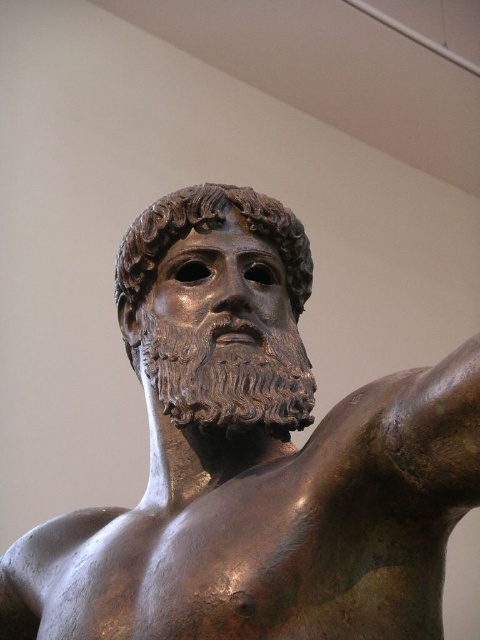
Question: Can you confirm if bronze statue at center is positioned to the right of bronze mask at center?

Choices:
 (A) yes
 (B) no

Answer: (A)

Question: Which object appears closest to the camera in this image?

Choices:
 (A) bronze statue at center
 (B) bronze mask at center

Answer: (B)

Question: Which point is farther to the camera?

Choices:
 (A) (193, 620)
 (B) (287, 436)

Answer: (B)

Question: Can you confirm if bronze statue at center is smaller than bronze mask at center?

Choices:
 (A) no
 (B) yes

Answer: (B)

Question: In this image, where is bronze statue at center located relative to bronze mask at center?

Choices:
 (A) left
 (B) right

Answer: (B)